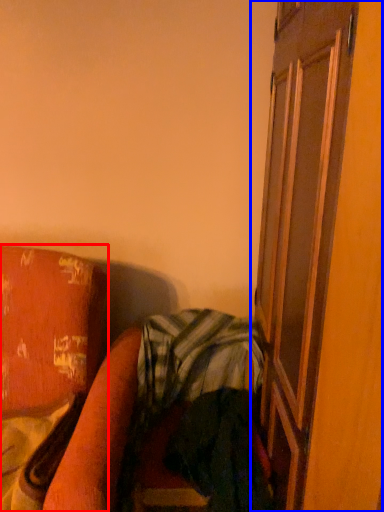
Question: Among these objects, which one is nearest to the camera, furniture (highlighted by a red box) or screen door (highlighted by a blue box)?

Choices:
 (A) furniture
 (B) screen door

Answer: (B)